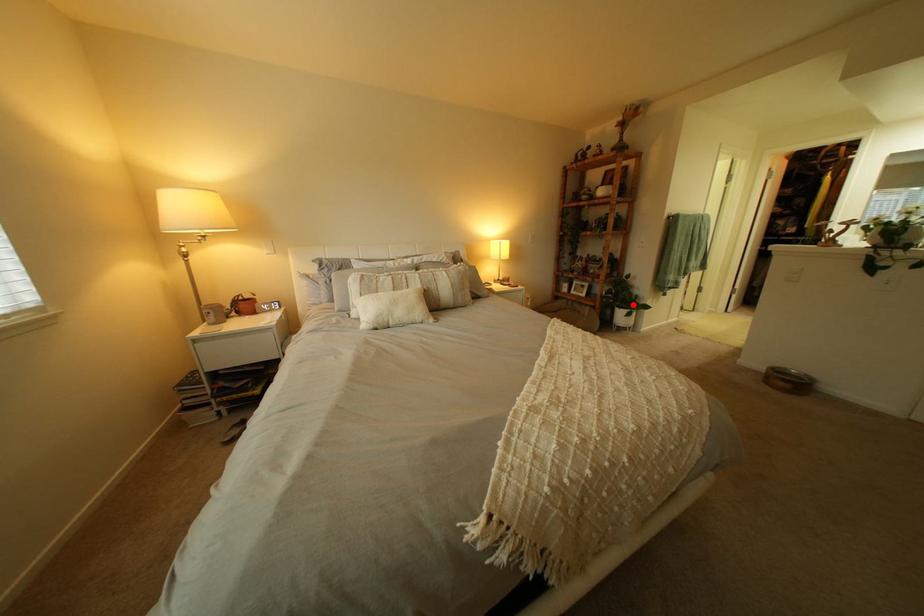
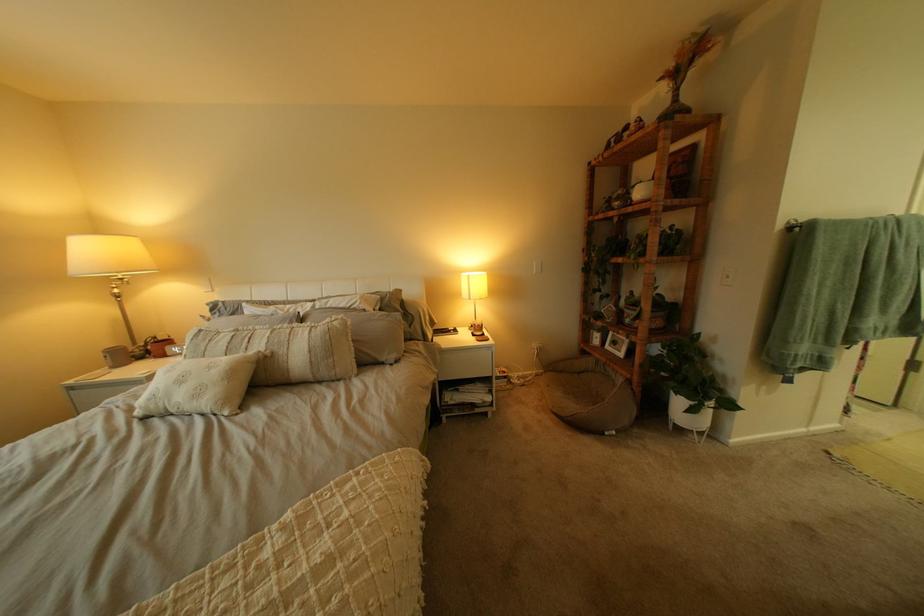
Question: I am providing you with two images of the same scene from different viewpoints. Given a red point in image1, look at the same physical point in image2. Is it:

Choices:
 (A) Closer to the viewpoint
 (B) Farther from the viewpoint

Answer: (B)